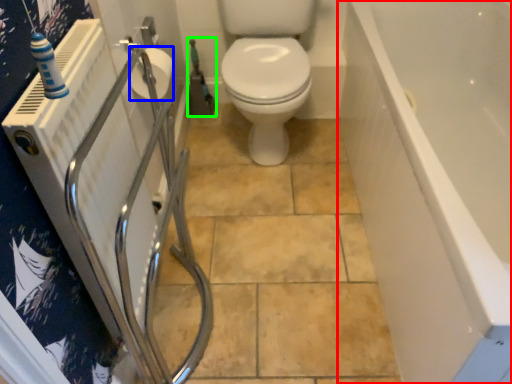
Question: Which object is the closest to the bath (highlighted by a red box)? Choose among these: toilet paper (highlighted by a blue box) or garden hose (highlighted by a green box).

Choices:
 (A) toilet paper
 (B) garden hose

Answer: (A)